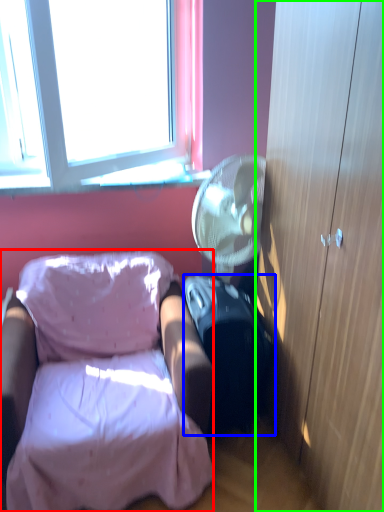
Question: Estimate the real-world distances between objects in this image. Which object is farther from chair (highlighted by a red box), suitcase (highlighted by a blue box) or cabinetry (highlighted by a green box)?

Choices:
 (A) suitcase
 (B) cabinetry

Answer: (B)